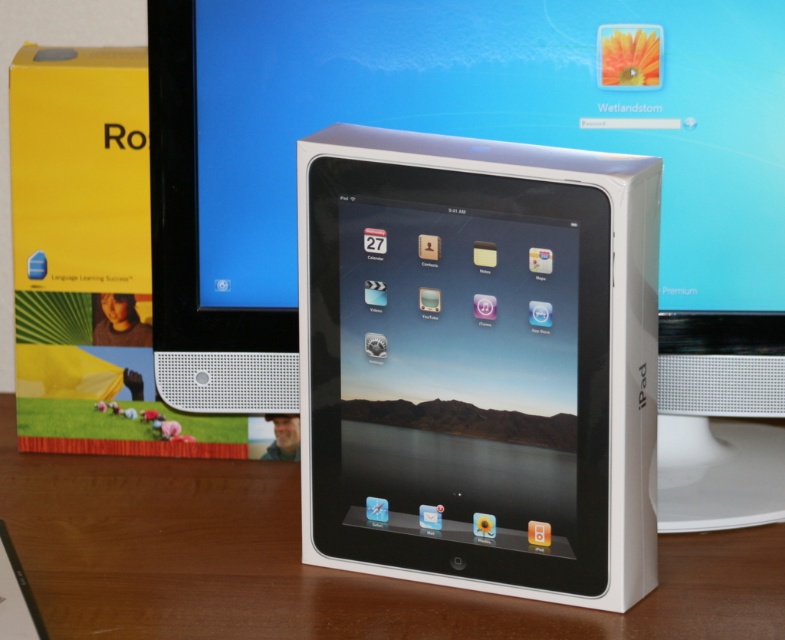
Consider the image. You are setting up a small workspace and have both the white glossy tablet at center and the wooden table at center available. Which object takes up more space in the workspace?

The wooden table at center takes up more space than the white glossy tablet at center because the white glossy tablet at center occupies less space than the wooden table at center.

You are setting up a display for a tech fair and need to place the white glossy tablet at center and the wooden table at center in a specific arrangement. According to the scene, which object is positioned to the right of the other?

The white glossy tablet at center is to the right of the wooden table at center.

You are holding a measuring tape and need to determine if a 36 inch long ribbon can reach from the camera to the point at coordinates point (409,420). Can it?

The point at coordinates point (409,420) is 35.44 inches away from the camera, so yes, the 36 inch long ribbon can reach it.